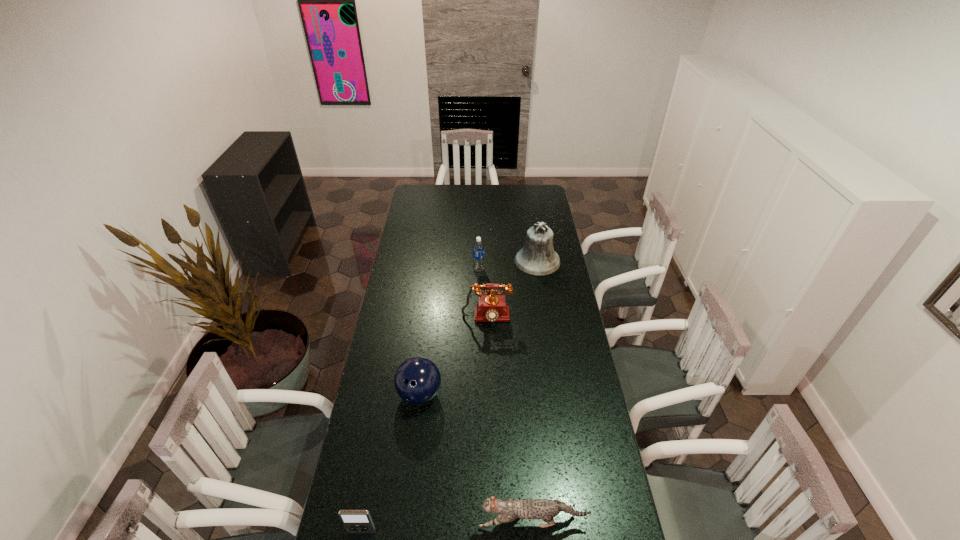
I want to click on bell, so click(538, 258).

The height and width of the screenshot is (540, 960). I want to click on water bottle, so pyautogui.click(x=478, y=247).

This screenshot has width=960, height=540. I want to click on telephone, so click(x=491, y=308).

The width and height of the screenshot is (960, 540). Find the location of `bowling ball`. bowling ball is located at coordinates (417, 380).

Locate an element on the screen. This screenshot has width=960, height=540. cat is located at coordinates (510, 509).

Locate an element on the screen. iPod is located at coordinates (355, 521).

The width and height of the screenshot is (960, 540). I want to click on vacant region located on the front of the tallest object, so click(x=545, y=314).

What are the coordinates of `blank space located on the right of the water bottle` in the screenshot? It's located at (542, 269).

The height and width of the screenshot is (540, 960). Find the location of `vacant space located on the dial of the telephone`. vacant space located on the dial of the telephone is located at coordinates (487, 336).

Locate an element on the screen. The height and width of the screenshot is (540, 960). free point located on the surface of the bowling ball near the finger holes is located at coordinates (409, 487).